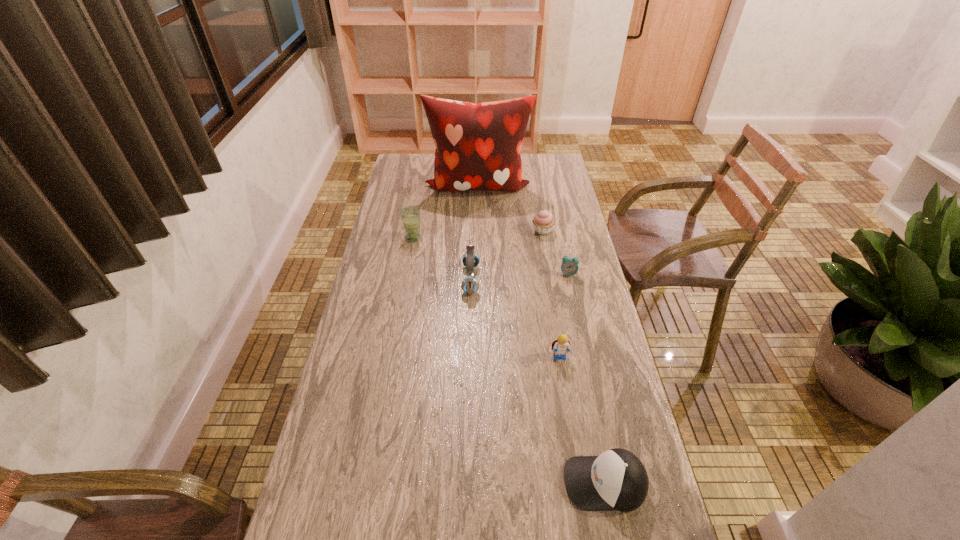
Locate an element on the screen. This screenshot has height=540, width=960. vacant region between the headset and the alarm clock is located at coordinates (519, 276).

At what (x,y) coordinates should I click in order to perform the action: click on vacant point located between the Lego and the headset. Please return your answer as a coordinate pair (x, y). Looking at the image, I should click on (516, 319).

Locate an element on the screen. vacant area that lies between the alarm clock and the glass is located at coordinates (491, 256).

At what (x,y) coordinates should I click in order to perform the action: click on free space between the nearest object and the alarm clock. Please return your answer as a coordinate pair (x, y). The image size is (960, 540). Looking at the image, I should click on click(587, 378).

You are a GUI agent. You are given a task and a screenshot of the screen. Output one action in this format:
    pyautogui.click(x=<x>, y=<y>)
    Task: Click on the empty location between the alarm clock and the nearest object
    
    Given the screenshot: What is the action you would take?
    pyautogui.click(x=587, y=378)

Image resolution: width=960 pixels, height=540 pixels. Find the location of `empty space between the alarm clock and the glass`. empty space between the alarm clock and the glass is located at coordinates (491, 256).

The image size is (960, 540). I want to click on vacant space that's between the alarm clock and the tallest object, so click(523, 230).

Find the location of a particular element. the closest object to the nearest object is located at coordinates (560, 346).

Image resolution: width=960 pixels, height=540 pixels. I want to click on object that is the fifth nearest to the Lego, so click(x=410, y=215).